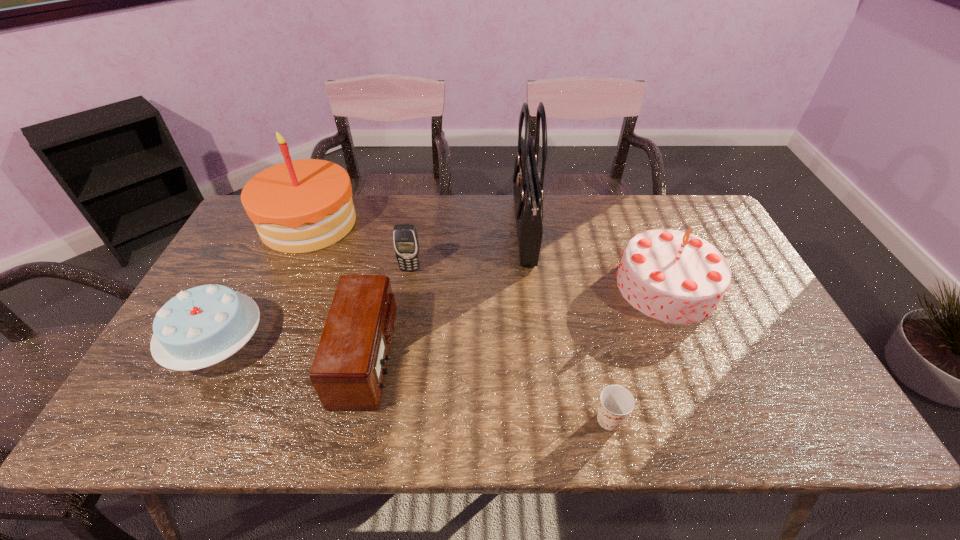
Image resolution: width=960 pixels, height=540 pixels. I want to click on vacant region between the second tallest object and the third tallest object, so 488,254.

Locate an element on the screen. This screenshot has width=960, height=540. free space between the shortest object and the tallest birthday cake is located at coordinates [459, 321].

In order to click on vacant area that lies between the sixth object from left to right and the second shortest birthday cake in this screenshot , I will do tap(638, 353).

Find the location of a particular element. This screenshot has width=960, height=540. vacant area that lies between the second tallest birthday cake and the radio receiver is located at coordinates (517, 322).

You are a GUI agent. You are given a task and a screenshot of the screen. Output one action in this format:
    pyautogui.click(x=<x>, y=<y>)
    Task: Click on the vacant region between the second tallest birthday cake and the second object from right to left
    The image size is (960, 540).
    Given the screenshot: What is the action you would take?
    pyautogui.click(x=638, y=353)

Locate an element on the screen. vacant region between the rightmost object and the radio receiver is located at coordinates (517, 322).

Locate an element on the screen. This screenshot has width=960, height=540. free point between the handbag and the radio receiver is located at coordinates (446, 294).

Locate which object is the fifth closest to the third object from right to left. Please provide its 2D coordinates. Your answer should be formatted as a tuple, i.e. [(x, y)], where the tuple contains the x and y coordinates of a point satisfying the conditions above.

[(299, 206)]

The height and width of the screenshot is (540, 960). I want to click on object that ranks as the closest to the shortest birthday cake, so click(x=348, y=371).

I want to click on birthday cake that can be found as the second closest to the tallest birthday cake, so [x=676, y=277].